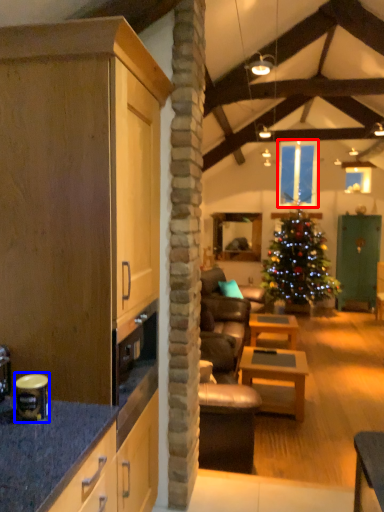
Question: Which of the following is the farthest to the observer, window (highlighted by a red box) or appliance (highlighted by a blue box)?

Choices:
 (A) window
 (B) appliance

Answer: (A)